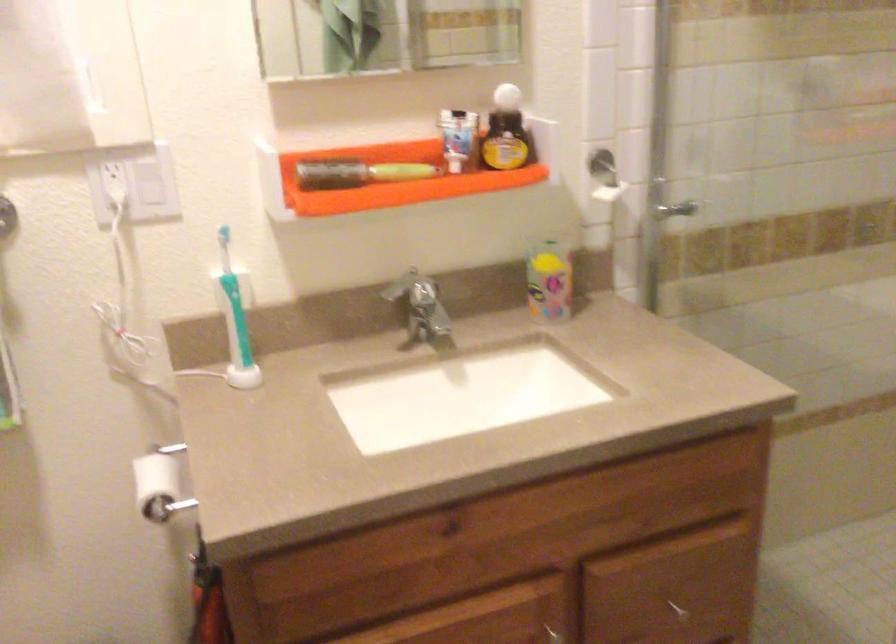
The location [358,173] corresponds to which object?

It corresponds to the yellow and black hairbrush in the image.